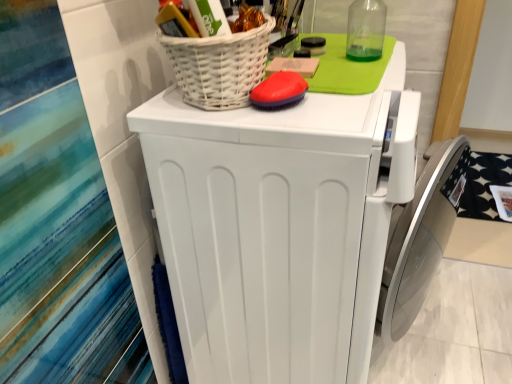
Locate an element on the screen. This screenshot has width=512, height=384. empty space that is to the right of red rubber brush at upper center is located at coordinates (351, 98).